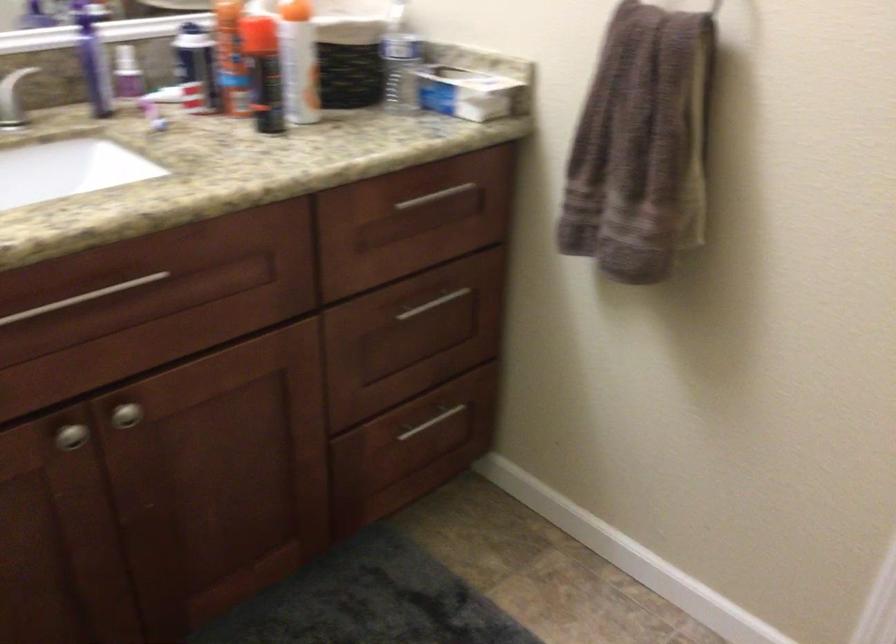
You are a GUI agent. You are given a task and a screenshot of the screen. Output one action in this format:
    pyautogui.click(x=<x>, y=<y>)
    Task: Click on the black spray can
    The width and height of the screenshot is (896, 644).
    Given the screenshot: What is the action you would take?
    pyautogui.click(x=194, y=61)